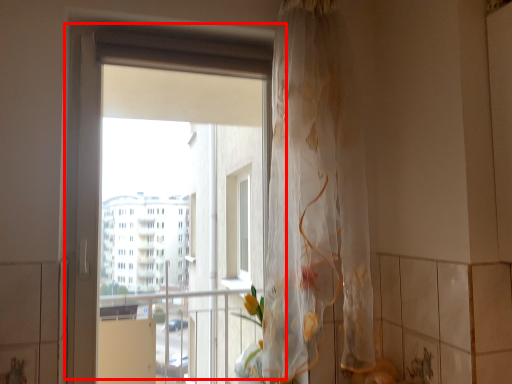
Question: From the image's perspective, what is the correct spatial relationship of window (annotated by the red box) in relation to curtain?

Choices:
 (A) below
 (B) above

Answer: (A)